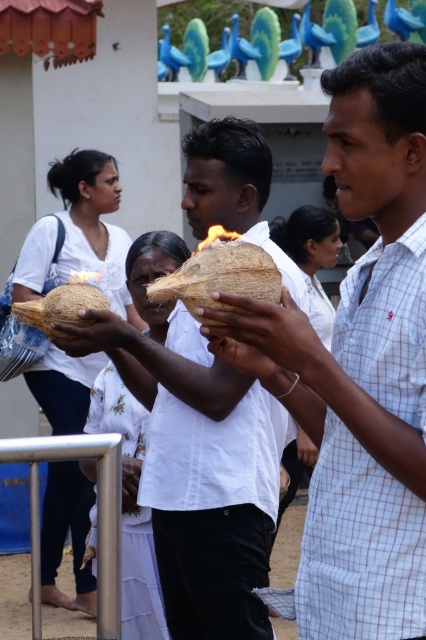
Is matte white coconut at center positioned at the back of yellow waxy candle at center?

That is False.

Identify the location of matte white coconut at center. (362, 364).

Image resolution: width=426 pixels, height=640 pixels. I want to click on matte white coconut at center, so click(x=362, y=364).

Is white matte coconut at center wider than brown fibrous coconut at center?

Indeed, white matte coconut at center has a greater width compared to brown fibrous coconut at center.

Which is more to the right, white matte coconut at center or brown fibrous coconut at center?

From the viewer's perspective, white matte coconut at center appears more on the right side.

Identify the location of white matte coconut at center. The height and width of the screenshot is (640, 426). (207, 481).

Between coconut shell at center and matte coconut at center, which one appears on the right side from the viewer's perspective?

From the viewer's perspective, coconut shell at center appears more on the right side.

Is coconut shell at center taller than matte coconut at center?

Yes, coconut shell at center is taller than matte coconut at center.

Between point (164, 627) and point (78, 336), which one is positioned behind?

Positioned behind is point (164, 627).

Identify the location of coconut shell at center. (129, 506).